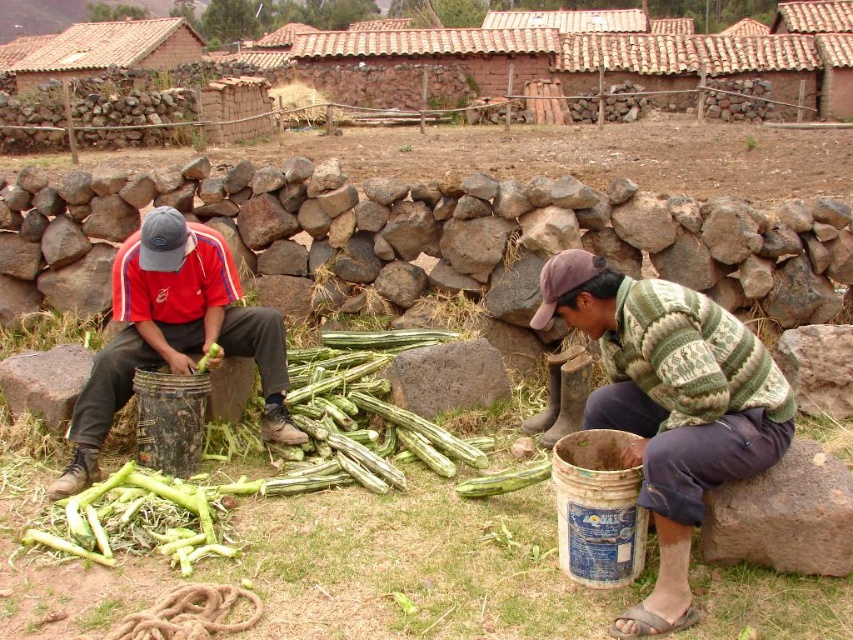
Is green knitted sweater at lower right smaller than green matte vegetable at center?

Actually, green knitted sweater at lower right might be larger than green matte vegetable at center.

Find the location of `green knitted sweater at lower right`. green knitted sweater at lower right is located at coordinates (670, 404).

Where is `green knitted sweater at lower right`? The width and height of the screenshot is (853, 640). green knitted sweater at lower right is located at coordinates (670, 404).

Does green knitted sweater at lower right have a greater height compared to matte black bucket at left?

No.

Does green knitted sweater at lower right appear under matte black bucket at left?

Yes, green knitted sweater at lower right is below matte black bucket at left.

Is point (699, 312) positioned before point (200, 294)?

Yes, point (699, 312) is in front of point (200, 294).

Where is `green knitted sweater at lower right`? The image size is (853, 640). green knitted sweater at lower right is located at coordinates (670, 404).

Can you confirm if green knitted sweater at lower right is bigger than green rough vegetable at center?

Indeed, green knitted sweater at lower right has a larger size compared to green rough vegetable at center.

Is green knitted sweater at lower right below green rough vegetable at center?

Actually, green knitted sweater at lower right is above green rough vegetable at center.

Locate an element on the screen. This screenshot has height=640, width=853. green knitted sweater at lower right is located at coordinates (670, 404).